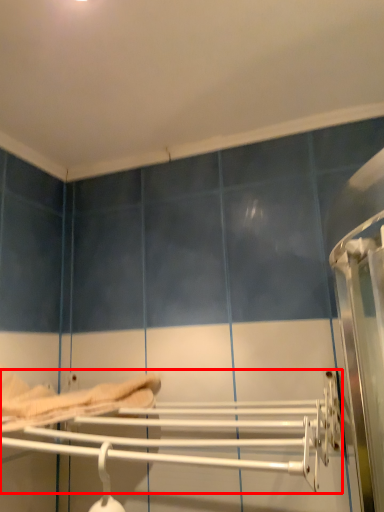
Question: Observing the image, what is the correct spatial positioning of towel rack (annotated by the red box) in reference to bed?

Choices:
 (A) left
 (B) right

Answer: (B)